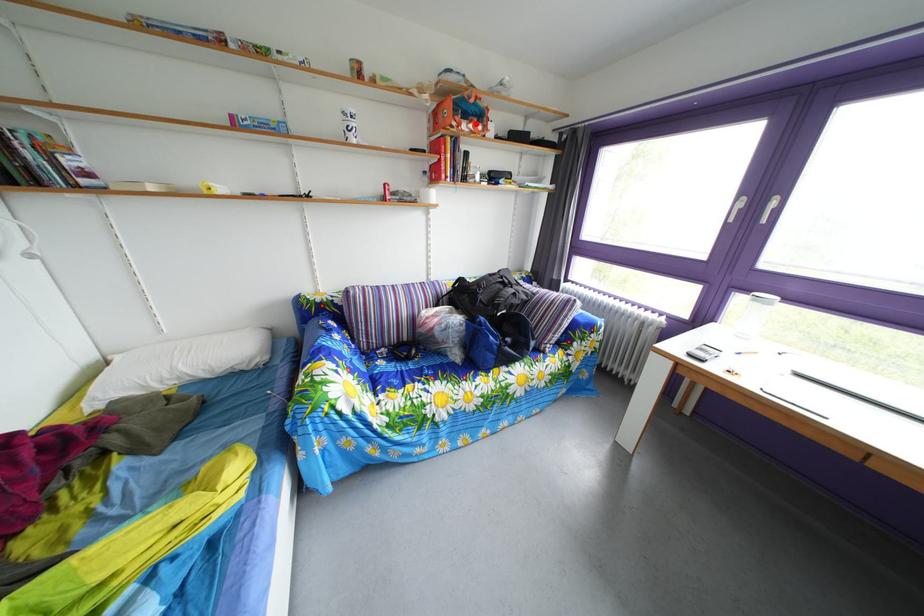
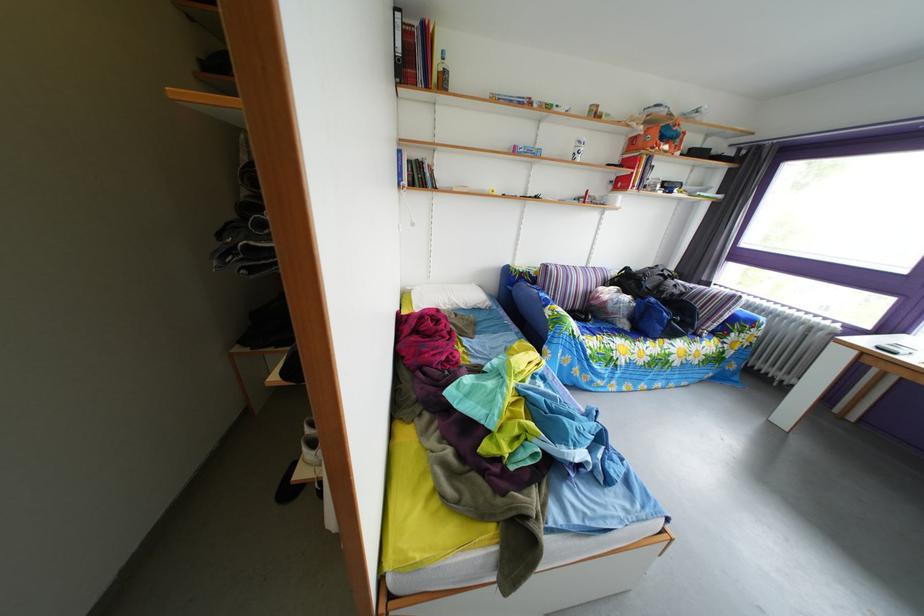
Locate, in the second image, the point that corresponds to the highlighted location in the first image.

(673, 147)